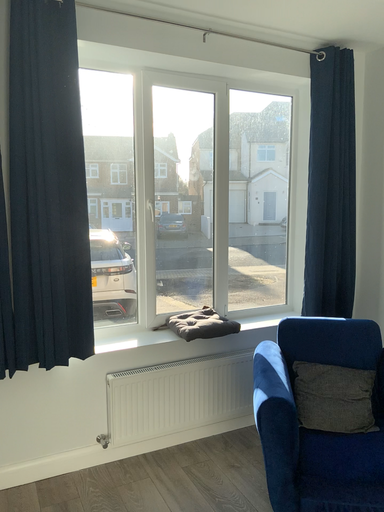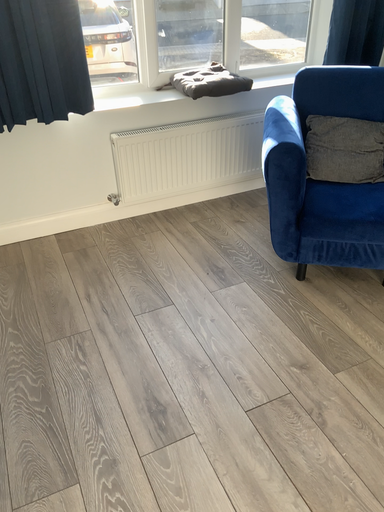
Question: Which way did the camera rotate in the video?

Choices:
 (A) rotated downward
 (B) rotated upward

Answer: (A)